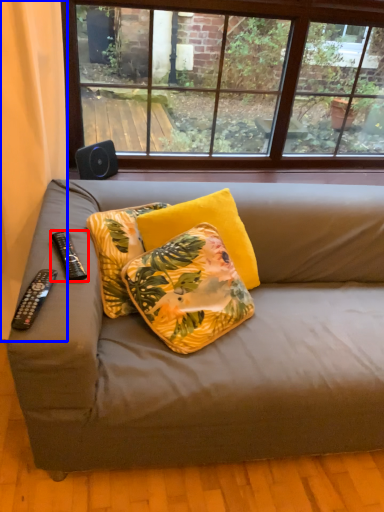
Question: Which object appears closest to the camera in this image, remote control (highlighted by a red box) or curtain (highlighted by a blue box)?

Choices:
 (A) remote control
 (B) curtain

Answer: (B)